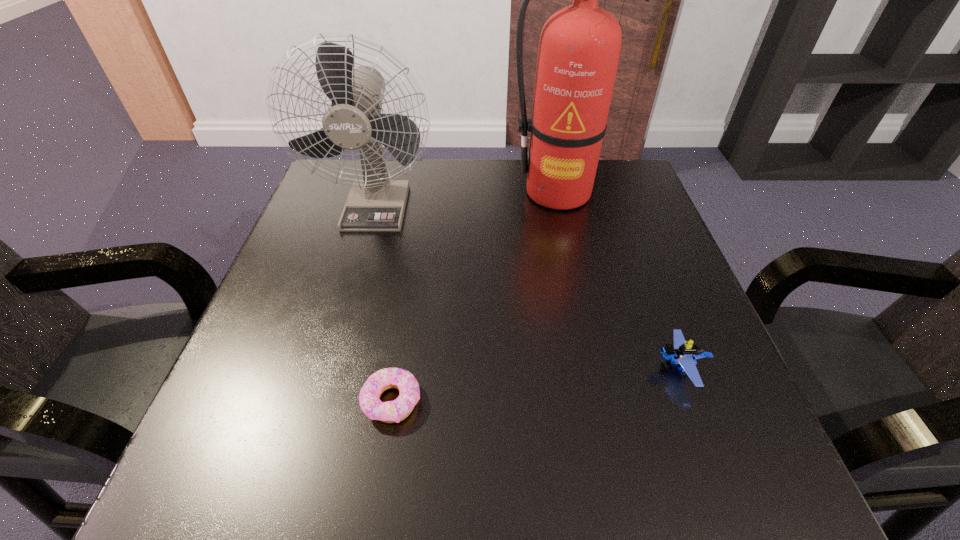
At what (x,y) coordinates should I click in order to perform the action: click on fire extinguisher present at the far edge. Please return your answer as a coordinate pair (x, y). Image resolution: width=960 pixels, height=540 pixels. Looking at the image, I should click on (579, 48).

Image resolution: width=960 pixels, height=540 pixels. Find the location of `fan situated at the far edge`. fan situated at the far edge is located at coordinates (354, 121).

Identify the location of object that is at the left edge. (354, 121).

In order to click on fire extinguisher located in the right edge section of the desktop in this screenshot , I will do `click(579, 48)`.

Locate an element on the screen. The image size is (960, 540). Lego present at the right edge is located at coordinates tap(682, 353).

In order to click on object present at the far left corner in this screenshot , I will do `click(354, 121)`.

Image resolution: width=960 pixels, height=540 pixels. What are the coordinates of `object present at the far right corner` in the screenshot? It's located at (579, 48).

Where is `vacant area at the far edge of the desktop`? Image resolution: width=960 pixels, height=540 pixels. vacant area at the far edge of the desktop is located at coordinates (519, 174).

Image resolution: width=960 pixels, height=540 pixels. I want to click on free location at the near edge of the desktop, so click(x=444, y=442).

Where is `blank space at the left edge of the desktop`? blank space at the left edge of the desktop is located at coordinates (308, 307).